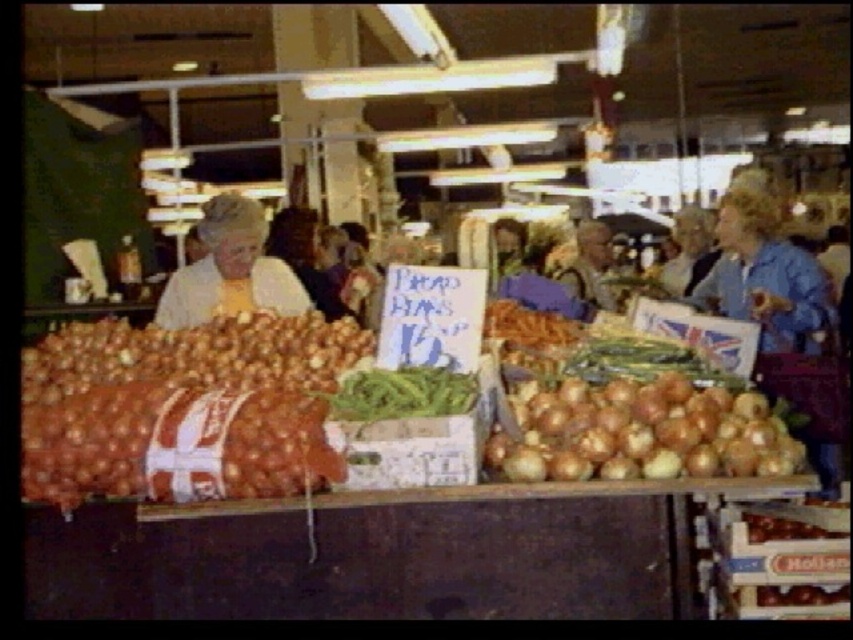
Does white fabric at center have a larger size compared to green matte beans at center?

Indeed, white fabric at center has a larger size compared to green matte beans at center.

Who is positioned more to the left, white fabric at center or green matte beans at center?

Positioned to the left is white fabric at center.

Locate an element on the screen. white fabric at center is located at coordinates (230, 269).

Who is taller, white fabric at center or green matte asparagus at center?

With more height is white fabric at center.

Does white fabric at center appear on the left side of green matte asparagus at center?

Indeed, white fabric at center is positioned on the left side of green matte asparagus at center.

Describe the element at coordinates (230, 269) in the screenshot. I see `white fabric at center` at that location.

I want to click on white fabric at center, so click(x=230, y=269).

Can you confirm if smooth brown onions at left is bigger than brown matte carrots at center?

Correct, smooth brown onions at left is larger in size than brown matte carrots at center.

Can you confirm if smooth brown onions at left is taller than brown matte carrots at center?

Indeed, smooth brown onions at left has a greater height compared to brown matte carrots at center.

Find the location of a particular element. This screenshot has width=853, height=640. smooth brown onions at left is located at coordinates (166, 396).